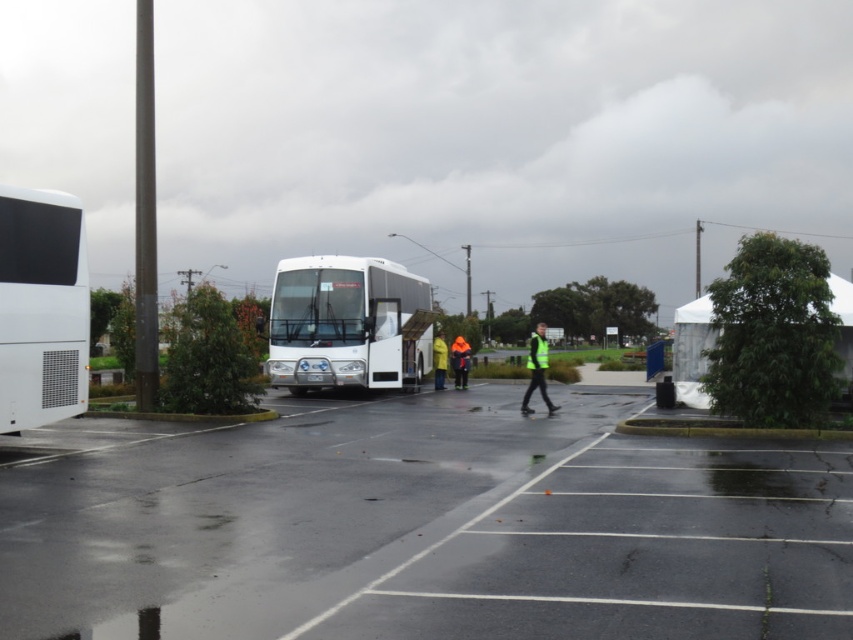
Question: Which point is closer to the camera?

Choices:
 (A) green leafy tree at right
 (B) white matte bus at center

Answer: (A)

Question: Can you confirm if green leafy tree at center is wider than orange reflective jacket at center?

Choices:
 (A) yes
 (B) no

Answer: (A)

Question: Estimate the real-world distances between objects in this image. Which object is farther from the green leafy tree at center?

Choices:
 (A) reflective yellow vest at center
 (B) green leafy tree at right

Answer: (B)

Question: Is white matte bus at left smaller than green leafy tree at center?

Choices:
 (A) yes
 (B) no

Answer: (A)

Question: Which object appears closest to the camera in this image?

Choices:
 (A) orange reflective jacket at center
 (B) reflective yellow jacket at center

Answer: (B)

Question: Does black asphalt parking lot at lower left have a larger size compared to green leafy tree at center?

Choices:
 (A) no
 (B) yes

Answer: (A)